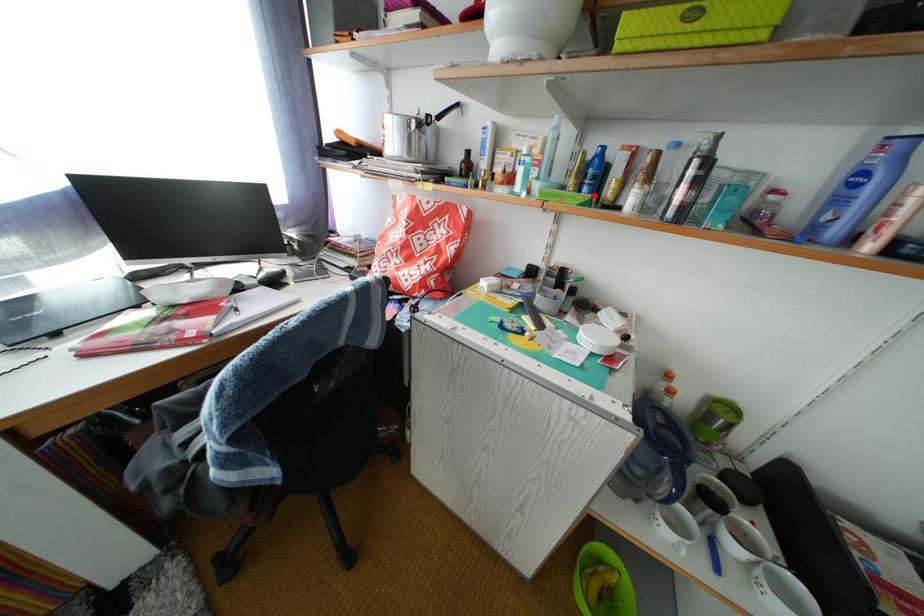
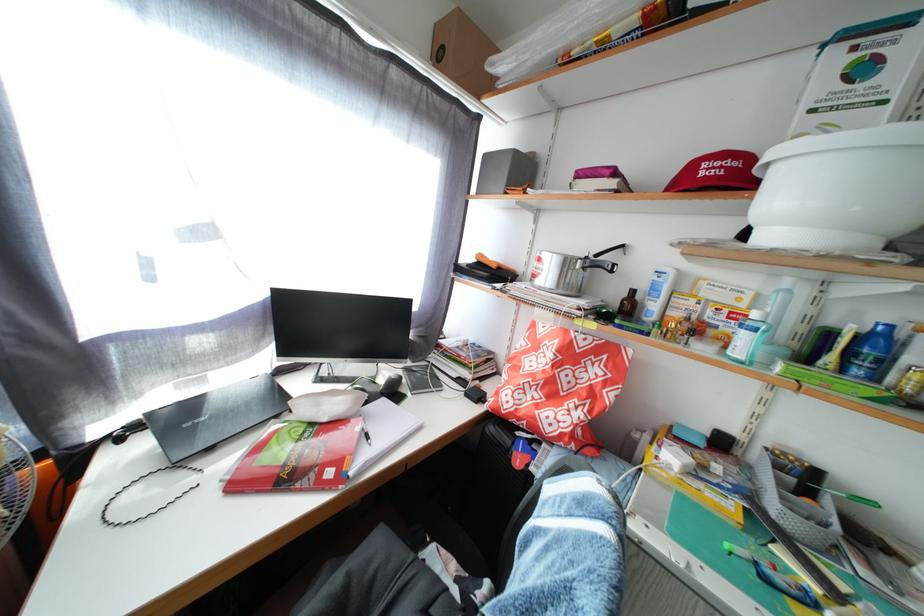
Question: I am providing you with two images of the same scene from different viewpoints. A red point is marked on the first image. Is the red point's position out of view in image 2?

Choices:
 (A) Yes
 (B) No

Answer: (B)